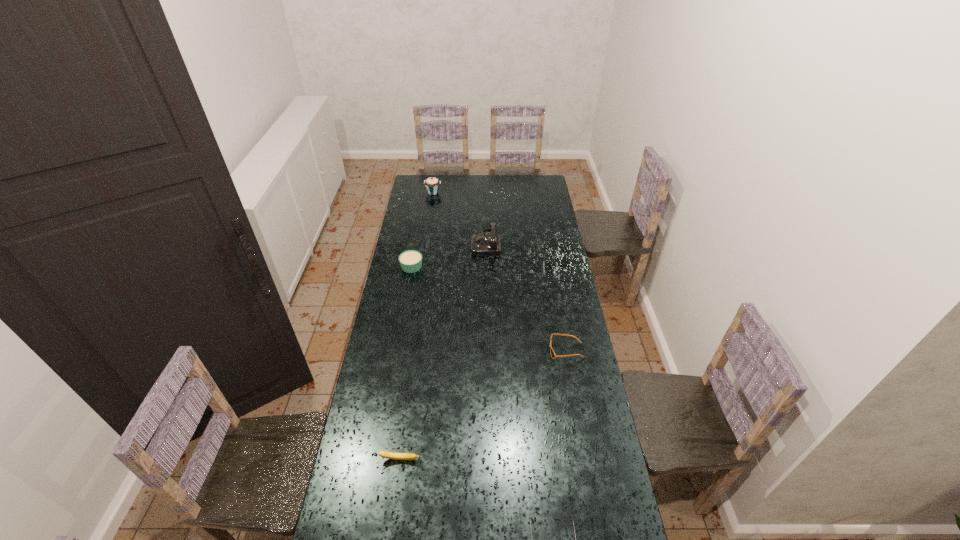
You are a GUI agent. You are given a task and a screenshot of the screen. Output one action in this format:
    pyautogui.click(x=<x>, y=<y>)
    Task: Click on the vacant area situated on the dial of the third object from right to left
    Image resolution: width=960 pixels, height=540 pixels.
    Given the screenshot: What is the action you would take?
    pyautogui.click(x=432, y=243)

Find the location of a particular element. free location located 0.150m on the dial of the third object from right to left is located at coordinates (444, 243).

This screenshot has height=540, width=960. In order to click on vacant position located 0.310m on the front of the farthest object in this screenshot , I will do `click(428, 227)`.

This screenshot has width=960, height=540. In order to click on vacant space located on the back of the shorter cupcake in this screenshot , I will do coord(415,249).

Locate an element on the screen. The image size is (960, 540). vacant space located 0.070m at the stem of the second nearest object is located at coordinates (396, 485).

Identify the location of vacant space situated on the front-facing side of the rightmost object. (474, 351).

Identify the location of vacant point located on the front-facing side of the rightmost object. The image size is (960, 540). (499, 351).

Identify the location of vacant area situated 0.390m on the front-facing side of the rightmost object. The height and width of the screenshot is (540, 960). (455, 351).

You are a GUI agent. You are given a task and a screenshot of the screen. Output one action in this format:
    pyautogui.click(x=<x>, y=<y>)
    Task: Click on the object at the far edge
    
    Given the screenshot: What is the action you would take?
    pyautogui.click(x=432, y=184)

This screenshot has width=960, height=540. Find the location of `banana positioned at the left edge`. banana positioned at the left edge is located at coordinates (389, 455).